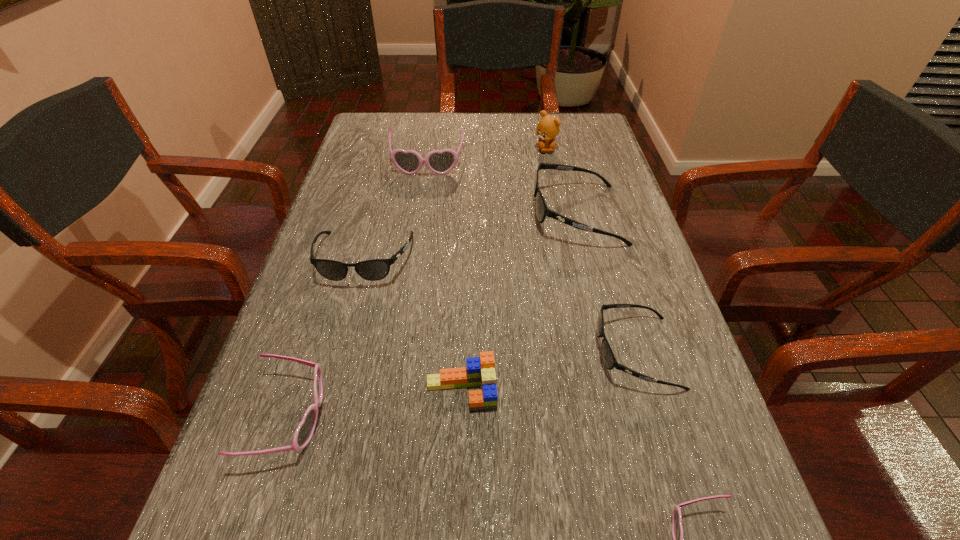
The height and width of the screenshot is (540, 960). What are the coordinates of `teddy bear` in the screenshot? It's located at (547, 129).

The height and width of the screenshot is (540, 960). In order to click on brown teddy bear in this screenshot , I will do `click(547, 129)`.

Image resolution: width=960 pixels, height=540 pixels. I want to click on the biggest gray sunglasses, so click(542, 211).

The image size is (960, 540). In order to click on the biggest pink sunglasses in this screenshot , I will do tap(410, 162).

This screenshot has width=960, height=540. I want to click on the farthest pink sunglasses, so click(x=410, y=162).

This screenshot has width=960, height=540. Find the location of `the second smallest gray sunglasses`. the second smallest gray sunglasses is located at coordinates (373, 270).

You are a GUI agent. You are given a task and a screenshot of the screen. Output one action in this format:
    pyautogui.click(x=<x>, y=<y>)
    Task: Click on the orange Lego
    This screenshot has width=960, height=540.
    Given the screenshot: What is the action you would take?
    pyautogui.click(x=480, y=371)

The width and height of the screenshot is (960, 540). In order to click on the second farthest pink sunglasses in this screenshot , I will do `click(304, 432)`.

Identify the location of the smallest gray sunglasses. This screenshot has height=540, width=960. [x=609, y=360].

Where is `blank space located 0.170m on the face of the brown teddy bear`? This screenshot has width=960, height=540. blank space located 0.170m on the face of the brown teddy bear is located at coordinates (x=553, y=190).